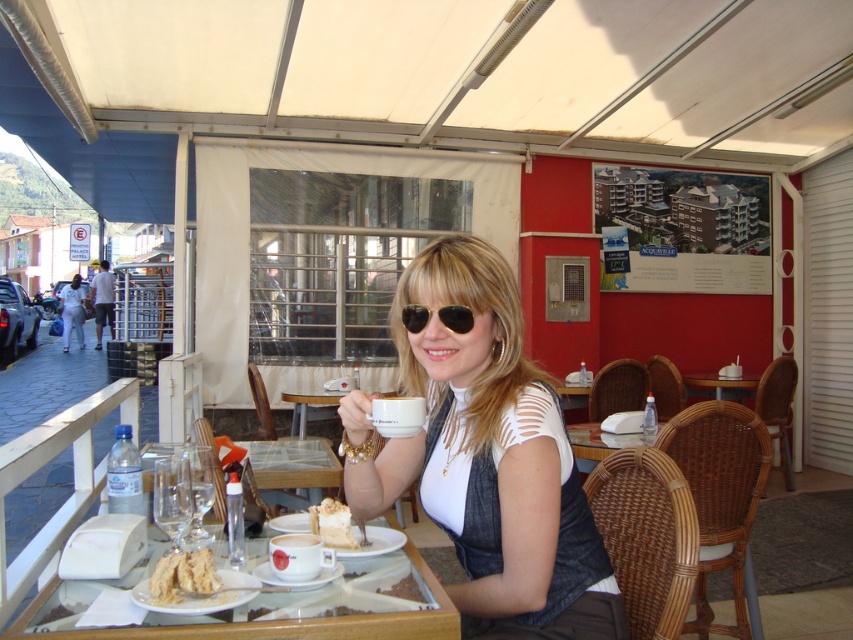
Does white matte shirt at center appear on the right side of black aviator sunglasses at center?

Correct, you'll find white matte shirt at center to the right of black aviator sunglasses at center.

Between white matte shirt at center and black aviator sunglasses at center, which one is positioned lower?

white matte shirt at center is lower down.

Between point (426, 512) and point (471, 321), which one is positioned in front?

Point (471, 321) is more forward.

You are a GUI agent. You are given a task and a screenshot of the screen. Output one action in this format:
    pyautogui.click(x=<x>, y=<y>)
    Task: Click on the white matte shirt at center
    This screenshot has width=853, height=640.
    Given the screenshot: What is the action you would take?
    pyautogui.click(x=486, y=458)

Between white matte shirt at center and light brown creamy cake at lower center, which one is positioned higher?

Positioned higher is white matte shirt at center.

Does white matte shirt at center come behind light brown creamy cake at lower center?

No, it is in front of light brown creamy cake at lower center.

Does point (457, 472) come in front of point (323, 515)?

Yes.

You are a GUI agent. You are given a task and a screenshot of the screen. Output one action in this format:
    pyautogui.click(x=<x>, y=<y>)
    Task: Click on the white matte shirt at center
    
    Given the screenshot: What is the action you would take?
    pyautogui.click(x=486, y=458)

Can you confirm if light brown creamy cake at lower center is positioned to the left of black aviator sunglasses at center?

Yes, light brown creamy cake at lower center is to the left of black aviator sunglasses at center.

Between point (351, 532) and point (467, 321), which one is positioned in front?

Point (467, 321) is more forward.

This screenshot has height=640, width=853. What do you see at coordinates (332, 524) in the screenshot? I see `light brown creamy cake at lower center` at bounding box center [332, 524].

Locate an element on the screen. The width and height of the screenshot is (853, 640). light brown creamy cake at lower center is located at coordinates (332, 524).